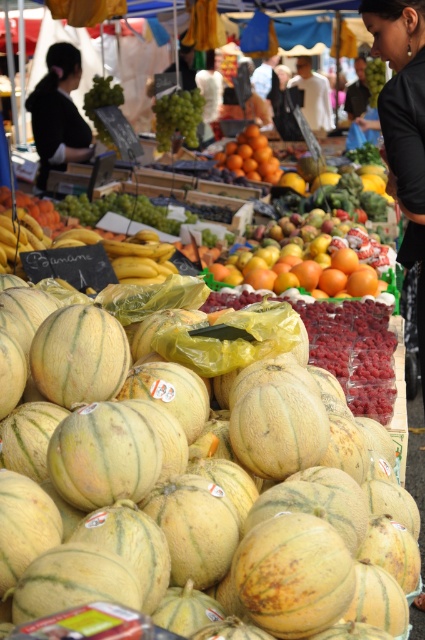
Question: Can you confirm if black fabric at center is positioned below orange matte at center?

Choices:
 (A) yes
 (B) no

Answer: (B)

Question: Is green striped cantaloupe at center positioned before green matte grapes at upper center?

Choices:
 (A) no
 (B) yes

Answer: (B)

Question: Among these points, which one is nearest to the camera?

Choices:
 (A) (246, 176)
 (B) (235, 576)

Answer: (B)

Question: Among these objects, which one is nearest to the camera?

Choices:
 (A) green matte grapes at upper center
 (B) black fabric at center

Answer: (B)

Question: Which object is the closest to the black fabric at center?

Choices:
 (A) black fabric at upper right
 (B) orange matte at center

Answer: (B)

Question: Can you confirm if black fabric at center is positioned above green matte grapes at upper center?

Choices:
 (A) yes
 (B) no

Answer: (B)